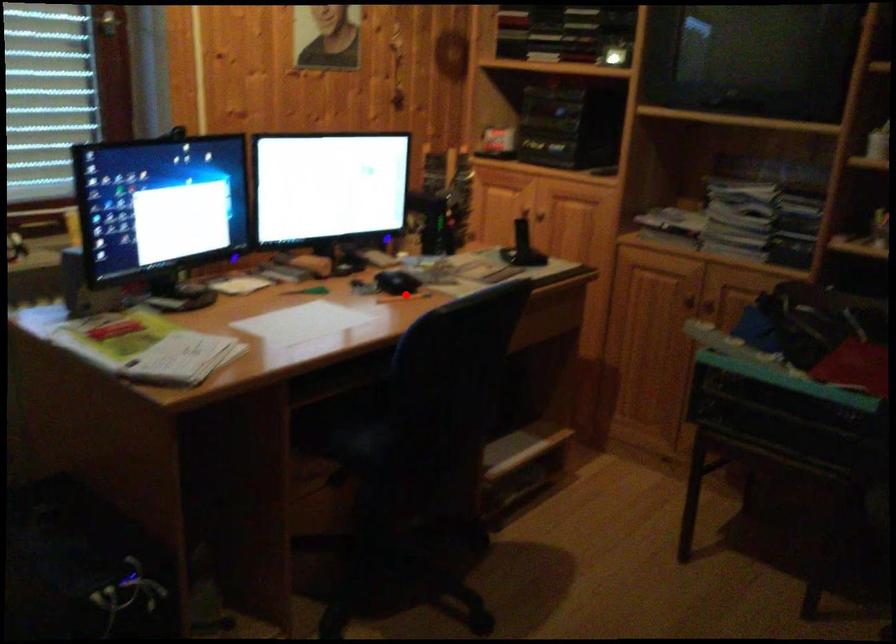
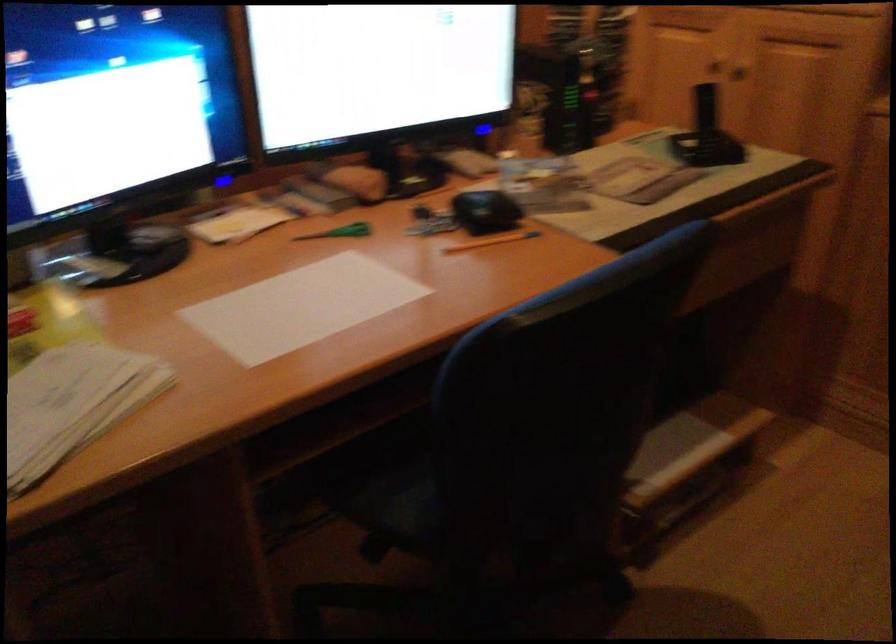
Question: I am providing you with two images of the same scene from different viewpoints. A red point is shown in image1. For the corresponding object point in image2, is it positioned nearer or farther from the camera?

Choices:
 (A) Nearer
 (B) Farther

Answer: (A)